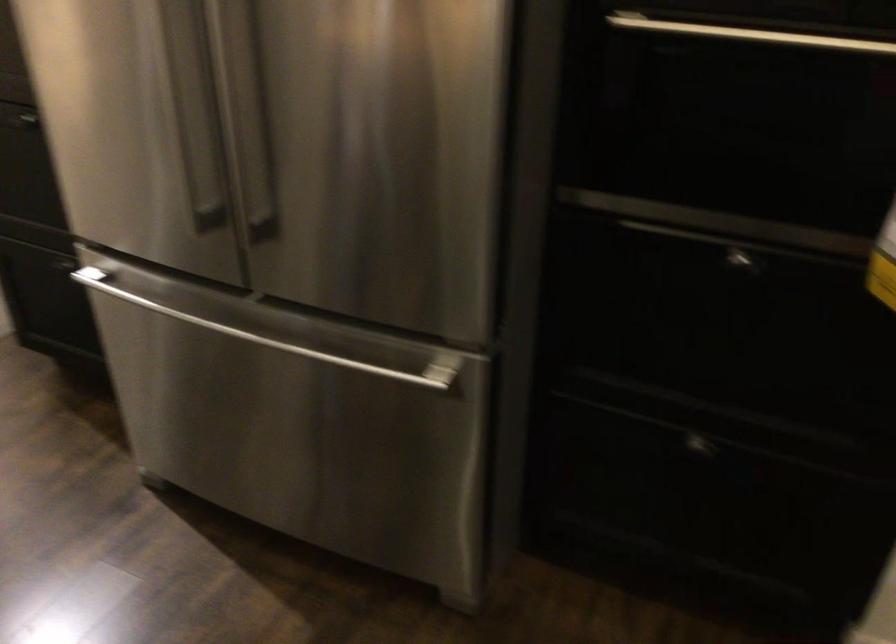
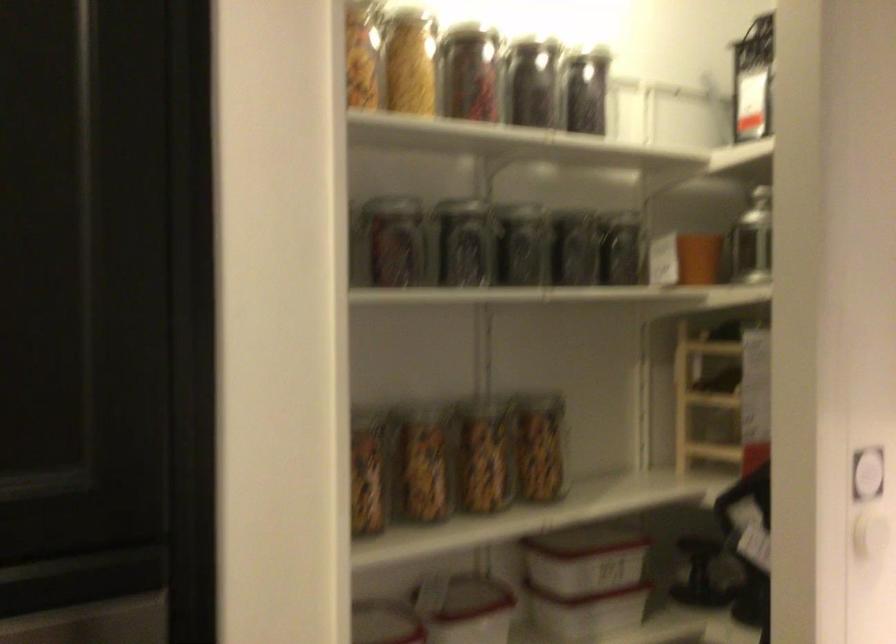
Question: The camera is either moving clockwise (left) or counter-clockwise (right) around the object. The first image is from the beginning of the video and the second image is from the end. Is the camera moving left or right when shooting the video?

Choices:
 (A) Left
 (B) Right

Answer: (A)